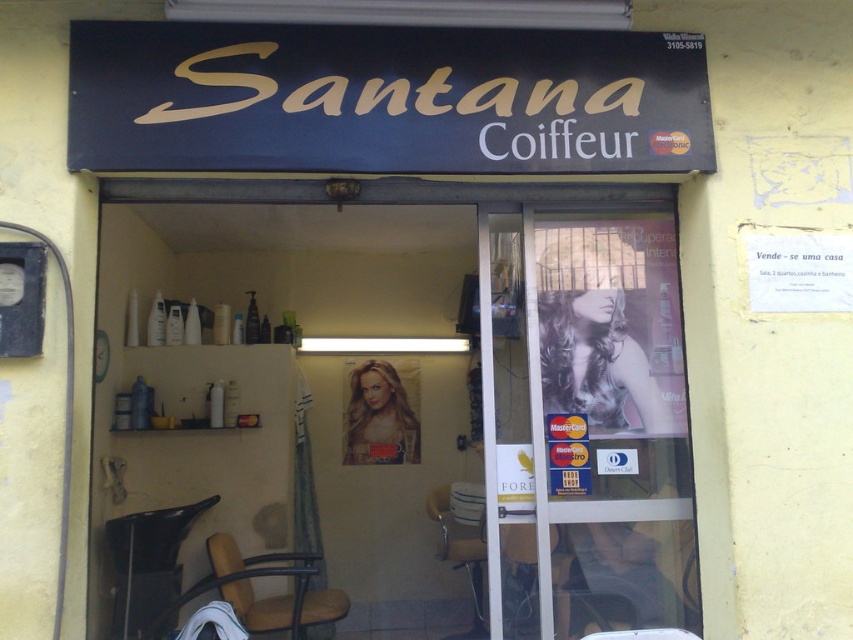
Who is lower down, transparent glass door at center or brown leather chair at lower center?

Positioned lower is brown leather chair at lower center.

The image size is (853, 640). I want to click on transparent glass door at center, so click(x=585, y=426).

Locate an element on the screen. The width and height of the screenshot is (853, 640). transparent glass door at center is located at coordinates (585, 426).

Can you confirm if transparent glass door at center is positioned above black plastic chair at lower left?

Yes, transparent glass door at center is above black plastic chair at lower left.

Does transparent glass door at center come behind black plastic chair at lower left?

No, transparent glass door at center is in front of black plastic chair at lower left.

Between point (637, 320) and point (111, 560), which one is positioned in front?

Positioned in front is point (637, 320).

This screenshot has width=853, height=640. Find the location of `transparent glass door at center`. transparent glass door at center is located at coordinates (585, 426).

Does matte gold sign at upper center appear on the right side of black plastic chair at lower left?

Correct, you'll find matte gold sign at upper center to the right of black plastic chair at lower left.

The height and width of the screenshot is (640, 853). Describe the element at coordinates (384, 99) in the screenshot. I see `matte gold sign at upper center` at that location.

Identify the location of matte gold sign at upper center. (384, 99).